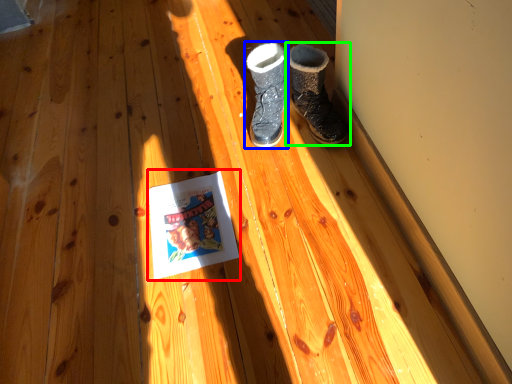
Question: Which object is positioned farthest from paperback book (highlighted by a red box)? Select from footwear (highlighted by a blue box) and footwear (highlighted by a green box).

Choices:
 (A) footwear
 (B) footwear

Answer: (B)